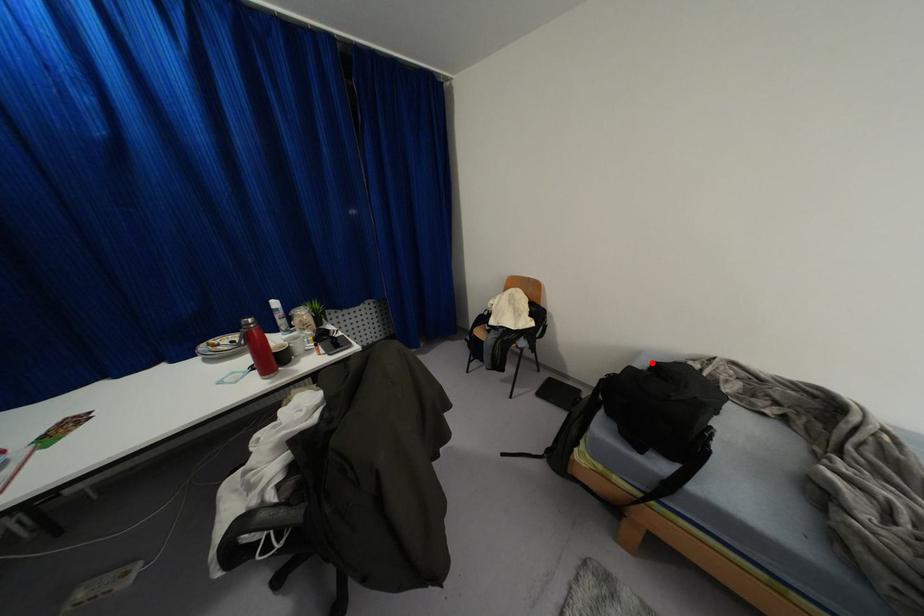
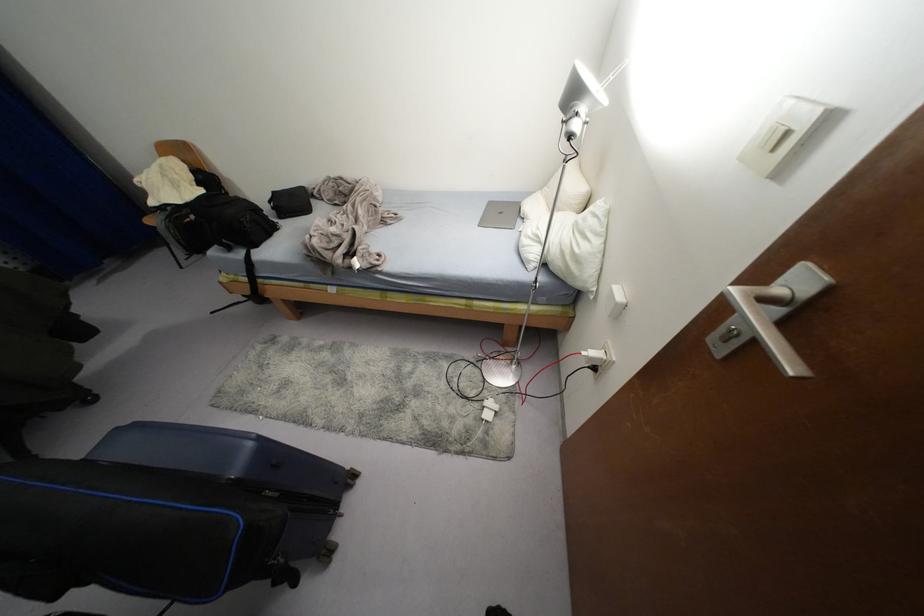
Find the pixel in the second image that matches the highlighted location in the first image.

(274, 192)